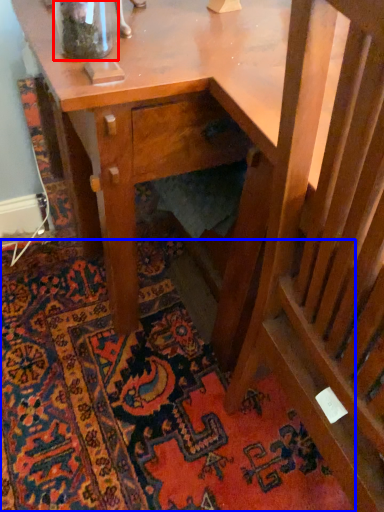
Question: Which object appears farthest to the camera in this image, glass vase (highlighted by a red box) or mat (highlighted by a blue box)?

Choices:
 (A) glass vase
 (B) mat

Answer: (B)